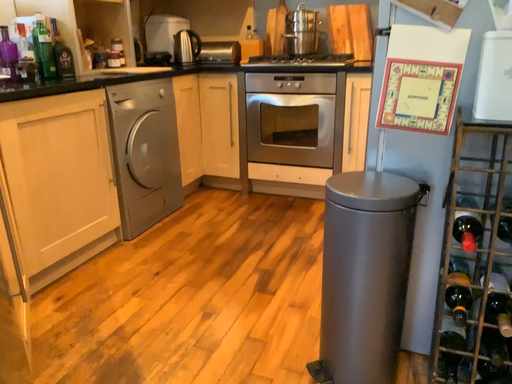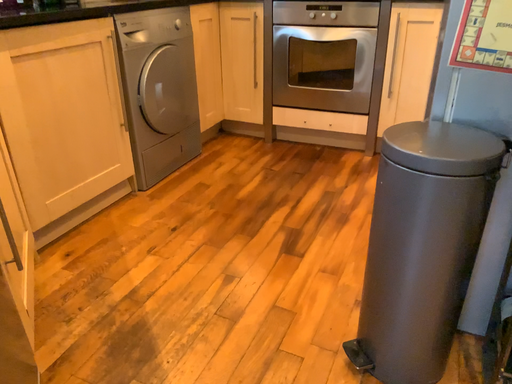
Question: How did the camera likely rotate when shooting the video?

Choices:
 (A) rotated downward
 (B) rotated upward

Answer: (A)